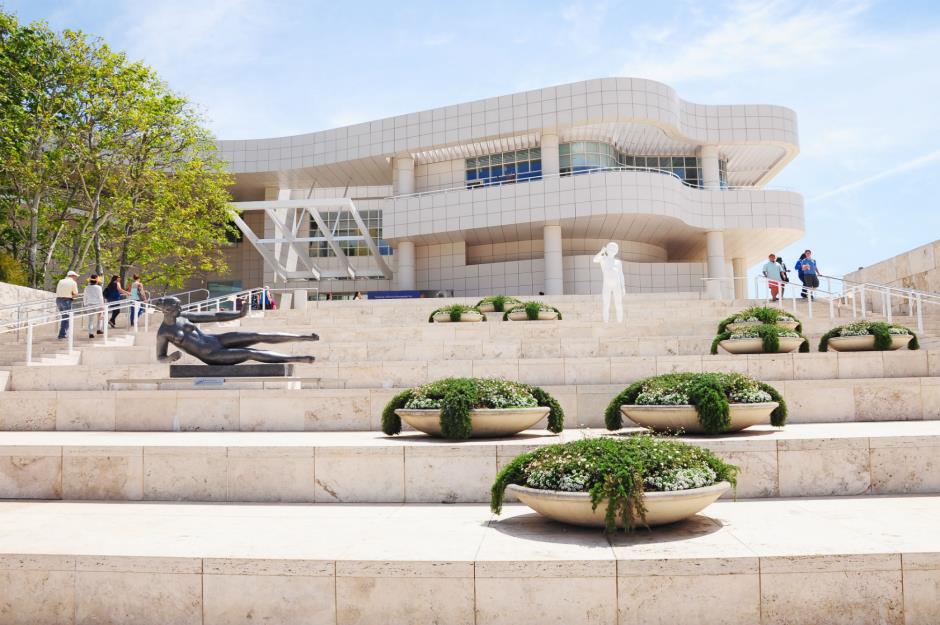
This screenshot has height=625, width=940. In order to click on white posts and handrails on stairs on left in this screenshot , I will do `click(104, 307)`, `click(70, 320)`, `click(32, 334)`, `click(123, 300)`, `click(81, 308)`, `click(43, 315)`, `click(16, 322)`.